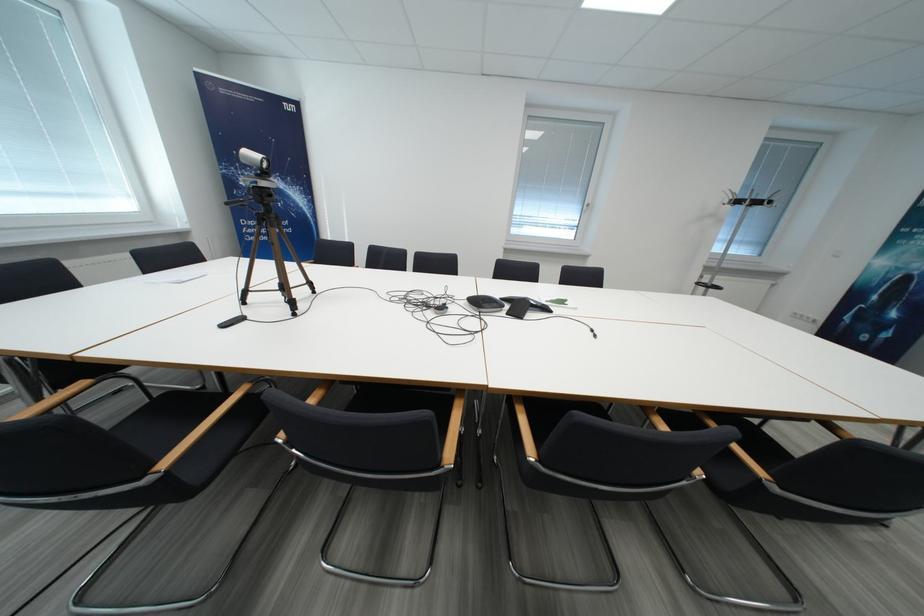
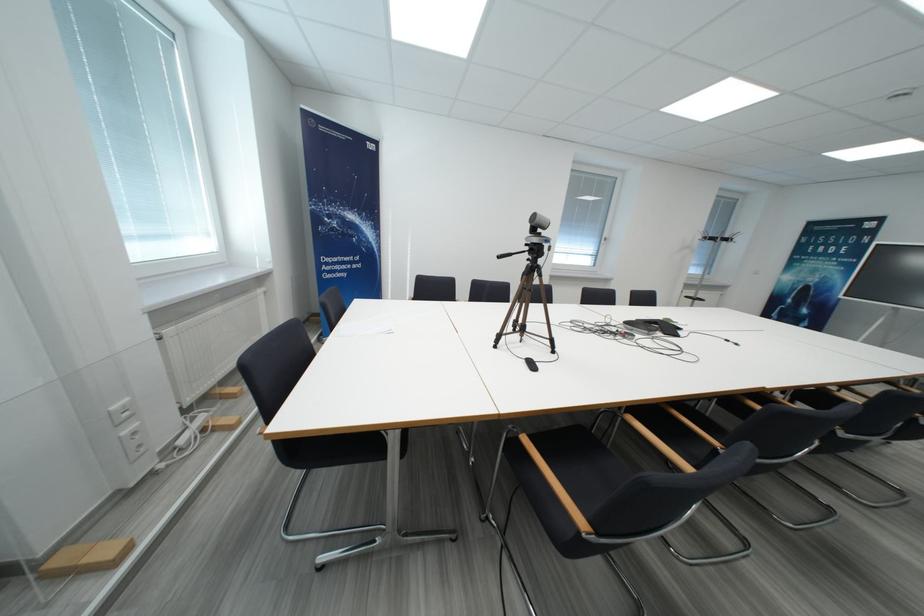
Question: What movement of the cameraman would produce the second image?

Choices:
 (A) Left
 (B) Right
 (C) Forward
 (D) Backward

Answer: (A)